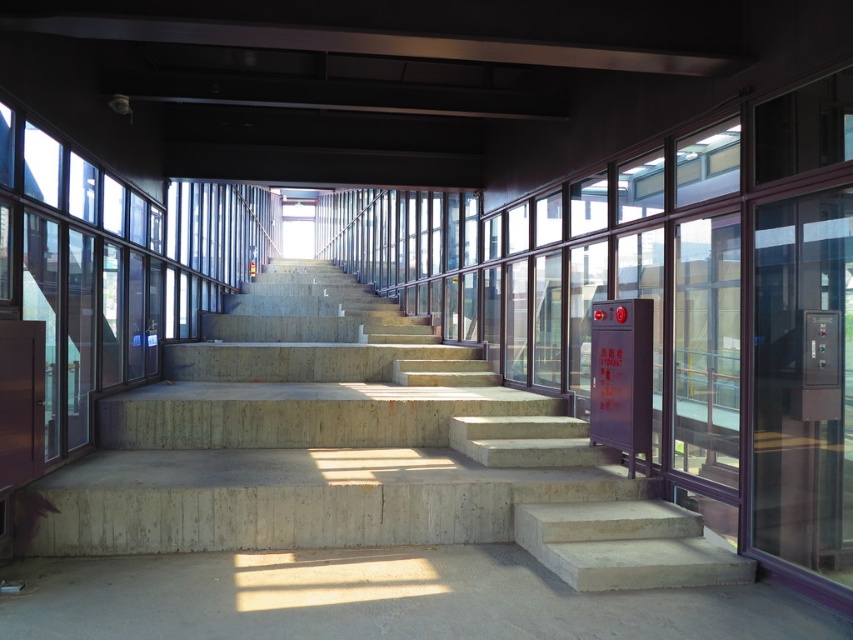
You are a delivery person carrying a large package that is 1.2 meters wide. You need to navigate through the gray concrete steps at center and the transparent glass door at right. Which one can accommodate your package without requiring you to adjust its size?

The gray concrete steps at center is larger in size than the transparent glass door at right, so the package can pass through the gray concrete steps at center without needing adjustment.

You are standing at the bottom of the staircase and want to take a photo of both the point at coordinates (434, 339) and the point at coordinates (323, 628). Which point should you focus on first to ensure both are in focus?

You should focus on the point at coordinates (434, 339) first because it is closer to the camera than the point at coordinates (323, 628). This ensures both points will be in focus as the focus will extend to the farther point.